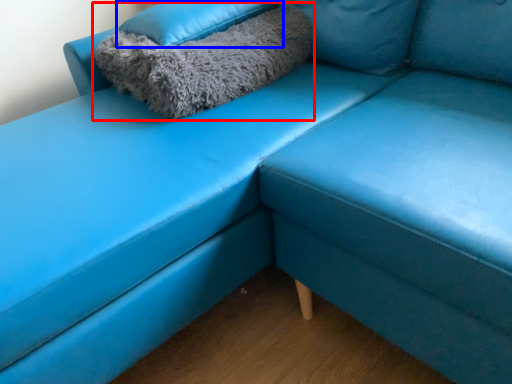
Question: Which object appears farthest to the camera in this image, pillow (highlighted by a red box) or pillow (highlighted by a blue box)?

Choices:
 (A) pillow
 (B) pillow

Answer: (B)